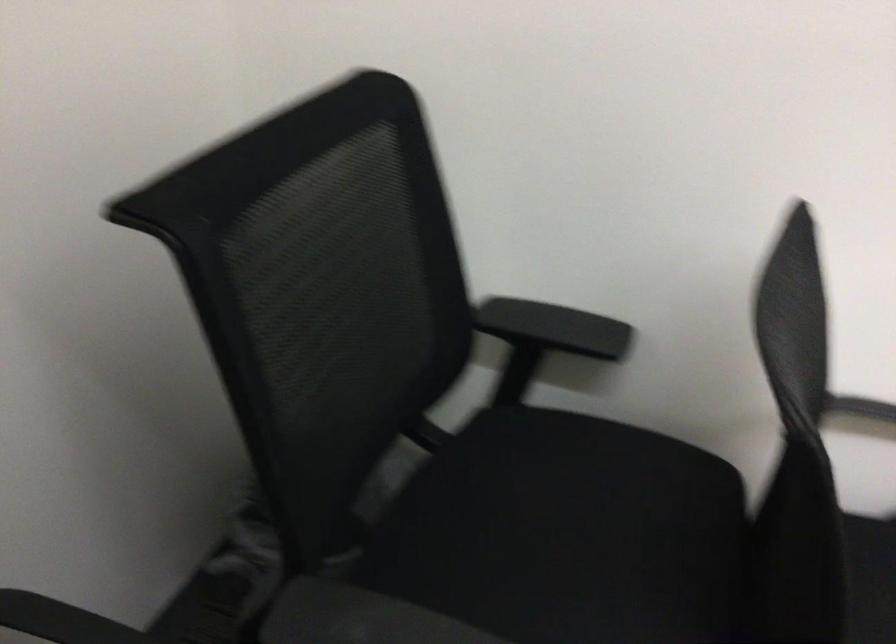
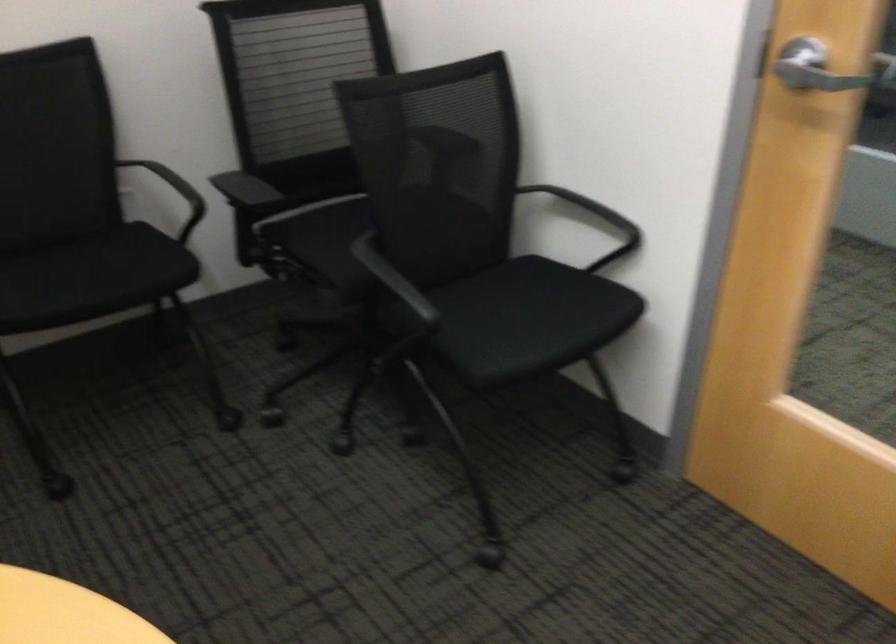
Question: I am providing you with two images of the same scene from different viewpoints. After the viewpoint changes to image2, which objects are now occluded?

Choices:
 (A) chair sitting surface
 (B) piano foot pedals
 (C) chair armrest
 (D) silver door handle

Answer: (A)